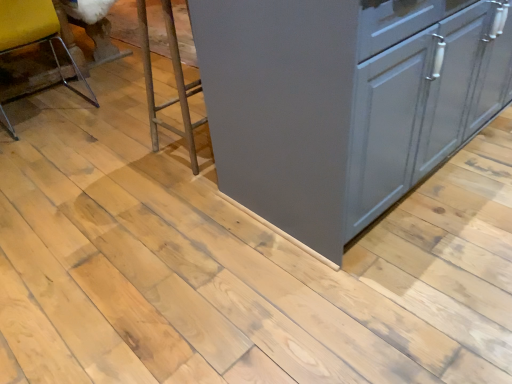
Find the location of a particular element. The height and width of the screenshot is (384, 512). vacant area that is situated to the right of clear plastic chair at left is located at coordinates (112, 107).